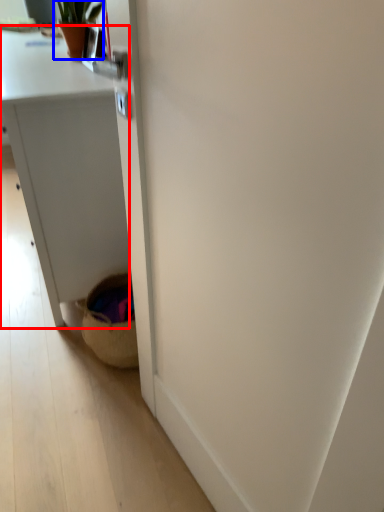
Question: Which of the following is the closest to the observer, desk (highlighted by a red box) or houseplant (highlighted by a blue box)?

Choices:
 (A) desk
 (B) houseplant

Answer: (A)